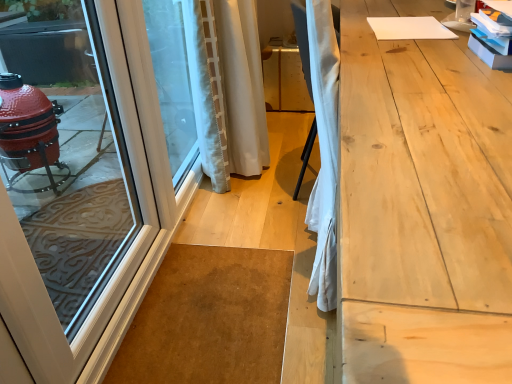
The width and height of the screenshot is (512, 384). Identify the location of free space to the right of white textured curtain at center. (295, 155).